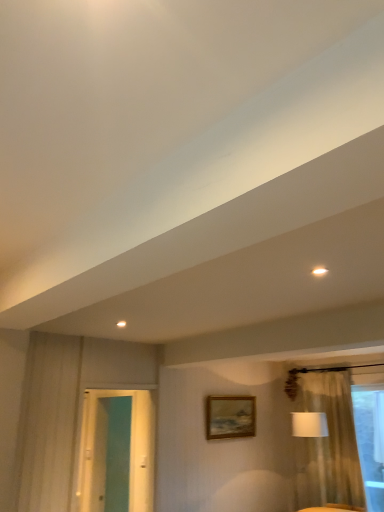
Question: From the image's perspective, is white fabric lampshade at right located above white glossy light fixture at upper right?

Choices:
 (A) no
 (B) yes

Answer: (A)

Question: Is white fabric lampshade at right positioned before white glossy light fixture at upper right?

Choices:
 (A) yes
 (B) no

Answer: (B)

Question: Is white fabric lampshade at right oriented away from white glossy light fixture at upper right?

Choices:
 (A) yes
 (B) no

Answer: (B)

Question: Considering the relative sizes of white fabric lampshade at right and white glossy light fixture at upper right in the image provided, is white fabric lampshade at right bigger than white glossy light fixture at upper right?

Choices:
 (A) yes
 (B) no

Answer: (A)

Question: From a real-world perspective, is white fabric lampshade at right physically below white glossy light fixture at upper right?

Choices:
 (A) no
 (B) yes

Answer: (B)

Question: From the image's perspective, is teal glossy door at left above or below wooden oil painting at center?

Choices:
 (A) below
 (B) above

Answer: (B)

Question: Does point (127, 395) appear closer or farther from the camera than point (211, 431)?

Choices:
 (A) farther
 (B) closer

Answer: (A)

Question: Would you say teal glossy door at left is inside or outside wooden oil painting at center?

Choices:
 (A) outside
 (B) inside

Answer: (A)

Question: From a real-world perspective, is teal glossy door at left physically located above or below wooden oil painting at center?

Choices:
 (A) above
 (B) below

Answer: (B)

Question: Relative to white fabric lampshade at right, is wooden oil painting at center in front or behind?

Choices:
 (A) front
 (B) behind

Answer: (B)

Question: From their relative heights in the image, would you say wooden oil painting at center is taller or shorter than white fabric lampshade at right?

Choices:
 (A) short
 (B) tall

Answer: (A)

Question: From a real-world perspective, is wooden oil painting at center positioned above or below white fabric lampshade at right?

Choices:
 (A) below
 (B) above

Answer: (B)

Question: Looking at their shapes, would you say wooden oil painting at center is wider or thinner than white fabric lampshade at right?

Choices:
 (A) wide
 (B) thin

Answer: (B)

Question: Considering the positions of white fabric lampshade at right and teal glossy door at left in the image, is white fabric lampshade at right wider or thinner than teal glossy door at left?

Choices:
 (A) wide
 (B) thin

Answer: (A)

Question: Considering the positions of point (306, 412) and point (82, 452), is point (306, 412) closer or farther from the camera than point (82, 452)?

Choices:
 (A) farther
 (B) closer

Answer: (A)